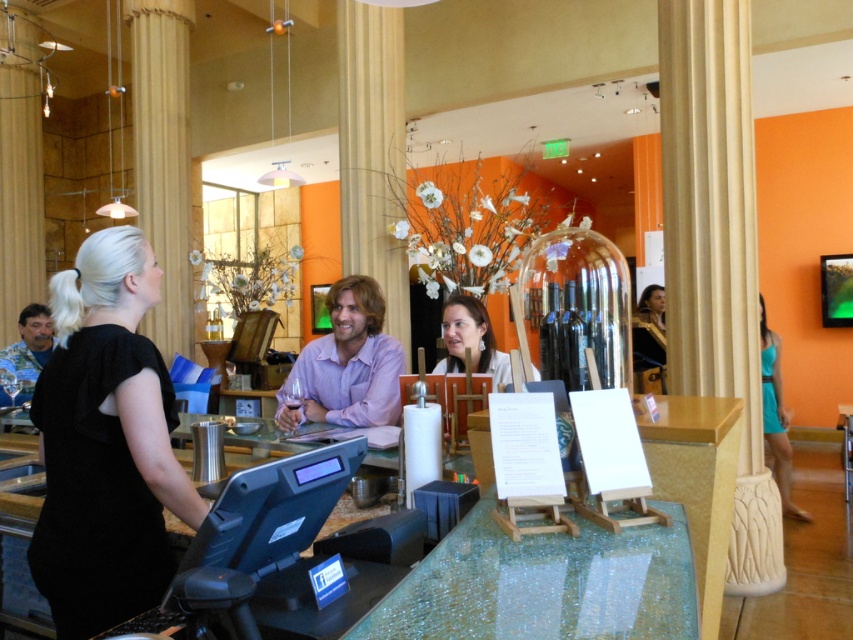
Question: Estimate the real-world distances between objects in this image. Which object is closer to the camouflage fabric shirt at left?

Choices:
 (A) matte white blouse at center
 (B) teal fabric dress at right
 (C) black matte dress at left

Answer: (C)

Question: Which point is farther from the camera taking this photo?

Choices:
 (A) (0, 369)
 (B) (480, 321)

Answer: (A)

Question: Which object is positioned farthest from the purple cotton shirt at center?

Choices:
 (A) black matte dress at left
 (B) matte white blouse at center
 (C) camouflage fabric shirt at left
 (D) teal fabric dress at right

Answer: (D)

Question: Is purple cotton shirt at center below matte white blouse at center?

Choices:
 (A) yes
 (B) no

Answer: (A)

Question: Can you confirm if purple cotton shirt at center is positioned above camouflage fabric shirt at left?

Choices:
 (A) yes
 (B) no

Answer: (A)

Question: Does black matte dress at left have a lesser width compared to camouflage fabric shirt at left?

Choices:
 (A) no
 (B) yes

Answer: (A)